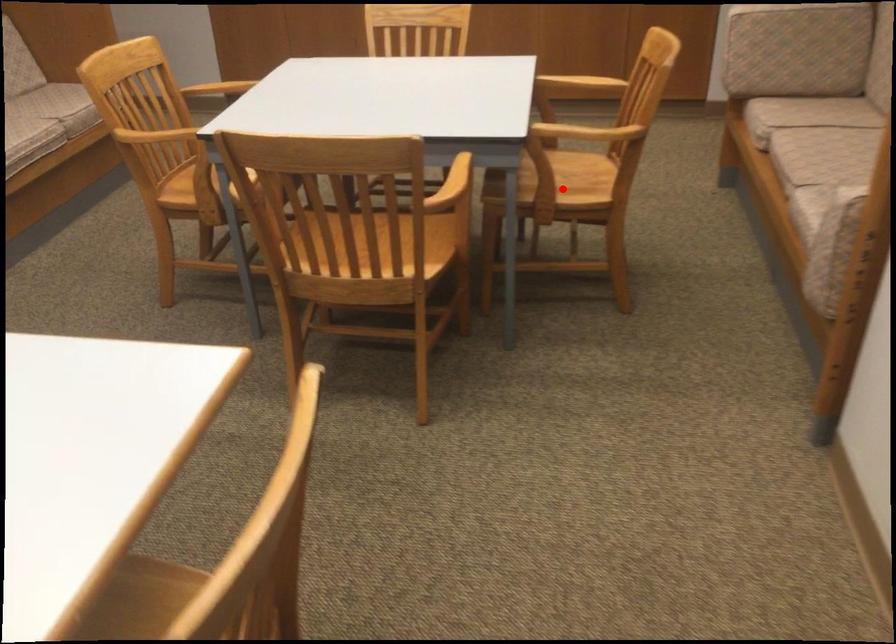
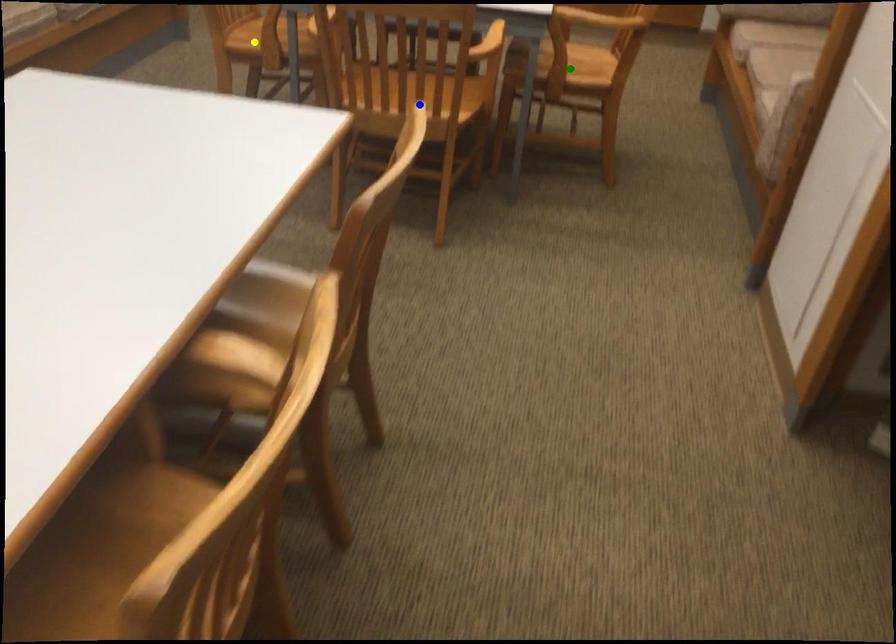
Question: I am providing you with two images of the same scene from different viewpoints. A red point is marked on the first image. You are given multiple points on the second image. Which point in image 2 is actually the same real-world point as the red point in image 1?

Choices:
 (A) blue point
 (B) green point
 (C) yellow point

Answer: (B)